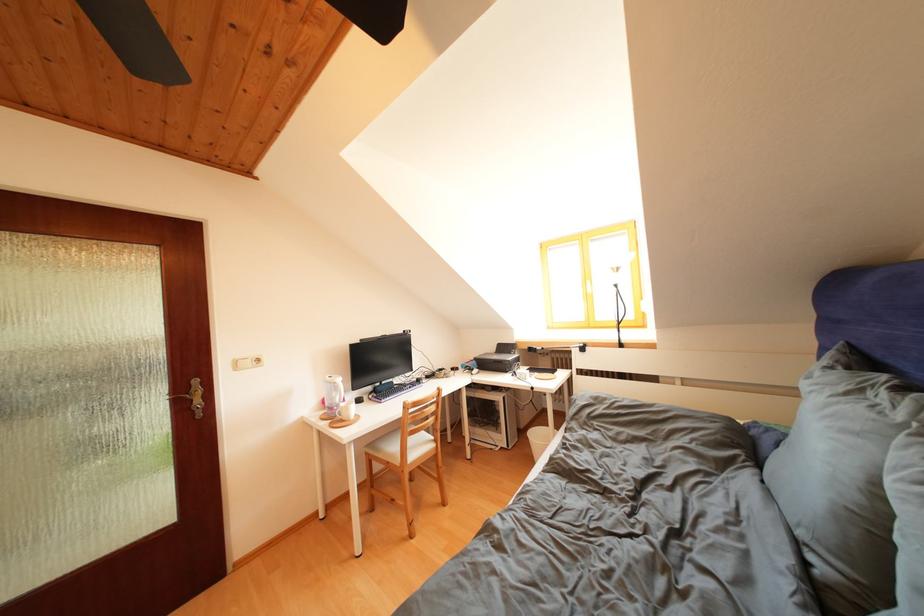
Where would you lift the white electric kettle? Please return your answer as a coordinate pair (x, y).

(333, 394)